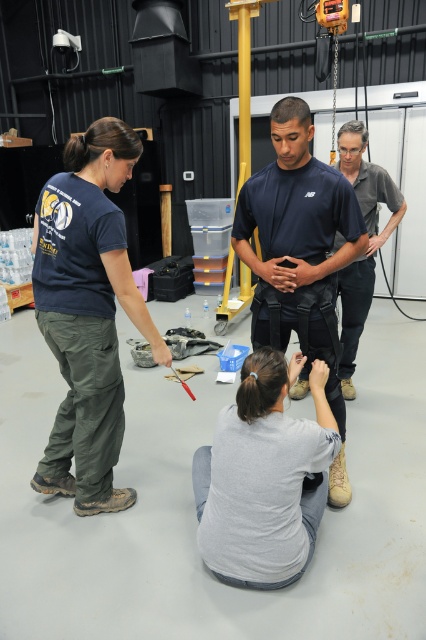
Based on the scene described, which individual is closer to the observer? The gray cotton shirt at lower center or the dark blue fabric shirt at center?

The gray cotton shirt at lower center is closer to the observer since it is in front of the dark blue fabric shirt at center according to the description.

Based on the scene described, which object from the list is bigger in size between the dark green cargo pants at left and the dark blue fabric shirt at center?

The dark green cargo pants at left is larger in size than the dark blue fabric shirt at center according to the description.